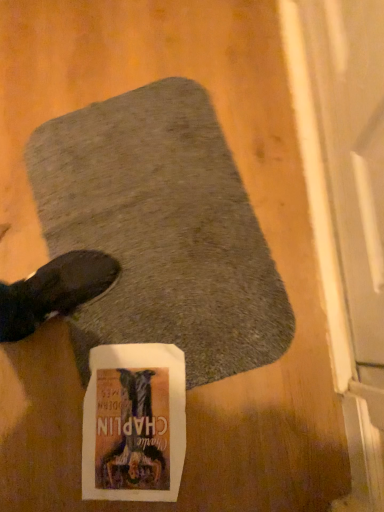
Identify the location of vacant space in between white paper flyer at center and gray soft rug at center. (166, 396).